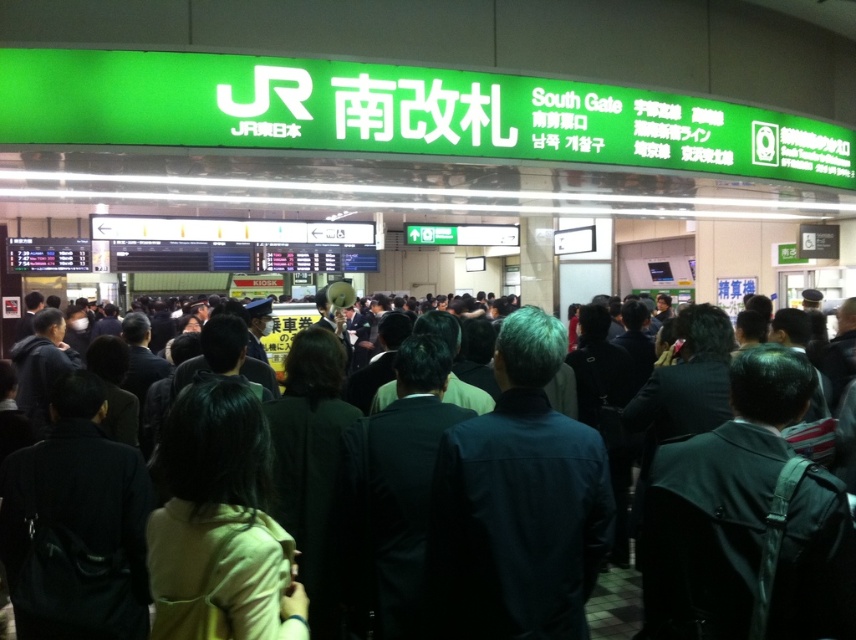
You are a photographer trying to capture a clear shot of the dark blue jacket at center and the dark blue suit at center in the crowded train station. Since both are dark blue, you need to adjust your camera angle to distinguish them. Based on their positions, which one should you focus on first to ensure both are in frame?

The dark blue jacket at center is positioned over the dark blue suit at center, so focusing on the dark blue jacket at center first will allow you to frame both, as it is above and likely closer to the camera.

You are standing at the South Gate of JR station and want to take a photo of both the large green signboard and the crowd below. You have two points marked on your camera screen at coordinates point (522, 634) and point (560, 396). Which point is better to focus on to ensure both the signboard and the crowd are in clear focus?

Point (522, 634) is closer to the viewer than point (560, 396). To ensure both the signboard and the crowd are in clear focus, focus on the point that is closer to you, which is point (522, 634). This will help keep the foreground and background elements sharp.

You are a photographer standing at the South Gate of JR station. You want to take a photo of the large green signboard above the crowd while ensuring both the dark blue jacket at center and the dark blue suit at center are visible in the frame. Which person should you position closer to the camera to avoid blocking the view?

The dark blue jacket at center is in front of the dark blue suit at center, so positioning the dark blue jacket at center closer to the camera would ensure it remains visible while potentially blocking the dark blue suit at center less. However, to ensure both are visible without one blocking the other, you might need to adjust the angle or zoom to include both in the frame without overlap.